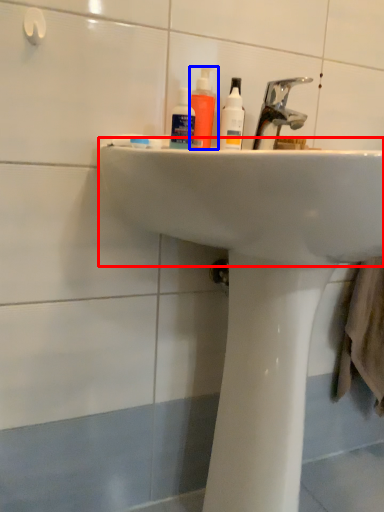
Question: Which object is closer to the camera taking this photo, sink (highlighted by a red box) or mouthwash (highlighted by a blue box)?

Choices:
 (A) sink
 (B) mouthwash

Answer: (A)